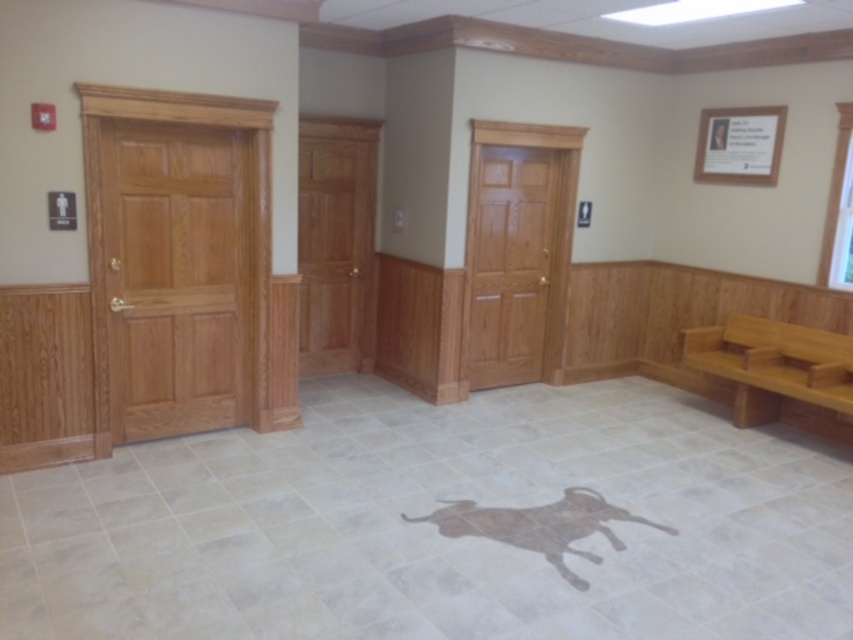
Question: Is light brown wood door at left behind brown wooden bench at lower right?

Choices:
 (A) no
 (B) yes

Answer: (A)

Question: Can you confirm if light oak wood door at center is positioned to the right of brown wooden bench at lower right?

Choices:
 (A) yes
 (B) no

Answer: (B)

Question: Which of the following is the farthest from the observer?

Choices:
 (A) light brown wood door at left
 (B) brown wooden bench at lower right

Answer: (B)

Question: Which point is closer to the camera?

Choices:
 (A) (213, 413)
 (B) (480, 273)
 (C) (804, 385)

Answer: (A)

Question: Does light brown wood door at left have a larger size compared to light oak wood door at center?

Choices:
 (A) no
 (B) yes

Answer: (A)

Question: Which point is farther to the camera?

Choices:
 (A) (193, 182)
 (B) (474, 269)

Answer: (B)